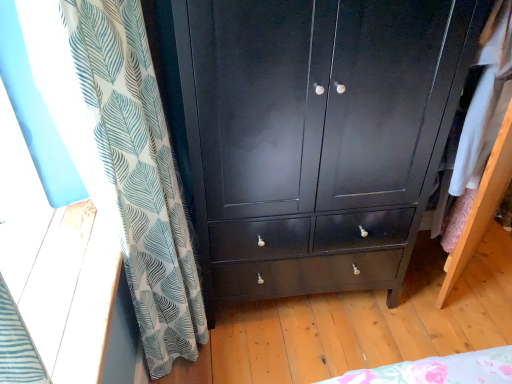
Where is `vacant space to the right of white leaf-patterned curtain at left`? vacant space to the right of white leaf-patterned curtain at left is located at coordinates (261, 359).